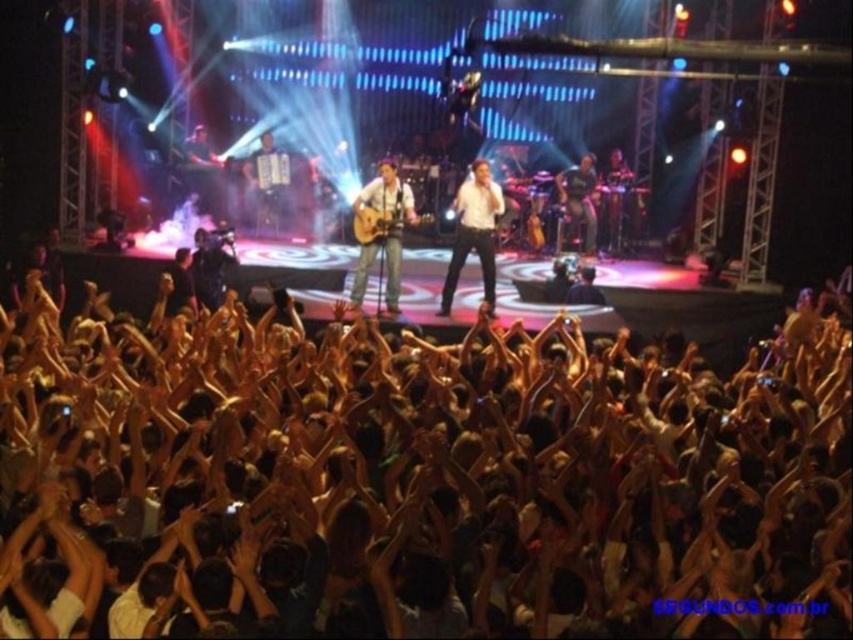
Question: Among these objects, which one is farthest from the camera?

Choices:
 (A) white smooth shirt at center
 (B) matte brown acoustic guitar at center

Answer: (B)

Question: Does brown skin tone crowd at center appear on the right side of matte brown acoustic guitar at center?

Choices:
 (A) yes
 (B) no

Answer: (A)

Question: Is brown skin tone crowd at center below matte brown acoustic guitar at center?

Choices:
 (A) no
 (B) yes

Answer: (B)

Question: Can you confirm if matte brown acoustic guitar at center is positioned to the right of white smooth shirt at center?

Choices:
 (A) no
 (B) yes

Answer: (A)

Question: Which of these objects is positioned closest to the white smooth shirt at center?

Choices:
 (A) matte brown acoustic guitar at center
 (B) brown skin tone crowd at center

Answer: (A)

Question: Which point is closer to the camera?

Choices:
 (A) (399, 257)
 (B) (486, 209)
 (C) (76, 440)
 (D) (369, 221)

Answer: (C)